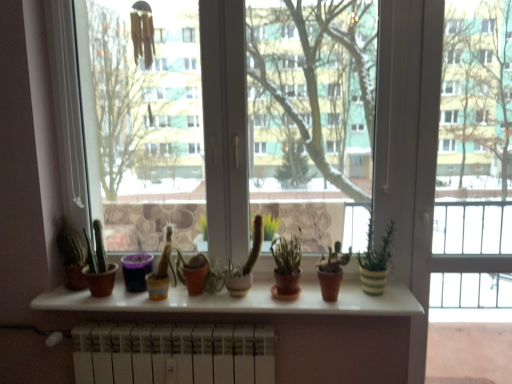
I want to click on free region under green matte cactus at center, which is counted as the 3th houseplant, starting from the left (from a real-world perspective), so click(239, 290).